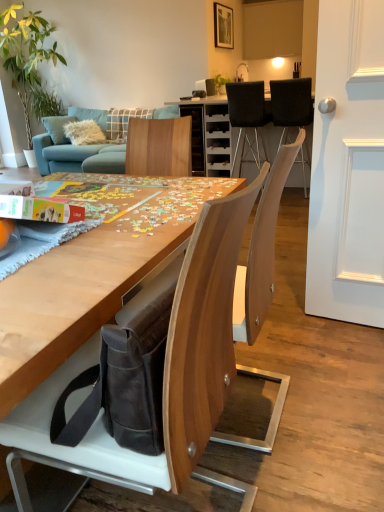
Question: Is black fabric chair at upper right, the second chair when ordered from front to back, taller or shorter than green leafy plant at upper left?

Choices:
 (A) tall
 (B) short

Answer: (B)

Question: From a real-world perspective, is black fabric chair at upper right, marked as the 3th chair in a bottom-to-top arrangement, physically located above or below green leafy plant at upper left?

Choices:
 (A) above
 (B) below

Answer: (B)

Question: Considering the real-world distances, which object is farthest from the wooden chair at center, the third chair positioned from the top?

Choices:
 (A) matte white cabinet at upper center
 (B) green leafy plant at upper left
 (C) black fabric chair at upper right, marked as the 3th chair in a bottom-to-top arrangement
 (D) teal fabric couch at upper left
 (E) black fabric chair at upper center, which is counted as the 2th chair, starting from the top

Answer: (A)

Question: Considering the real-world distances, which object is closest to the black fabric chair at upper center, the 1th chair in the back-to-front sequence?

Choices:
 (A) green leafy plant at upper left
 (B) matte white cabinet at upper center
 (C) teal fabric couch at upper left
 (D) black fabric chair at upper right, the 2th chair in the back-to-front sequence
 (E) wooden chair at center, which is counted as the third chair, starting from the right

Answer: (D)